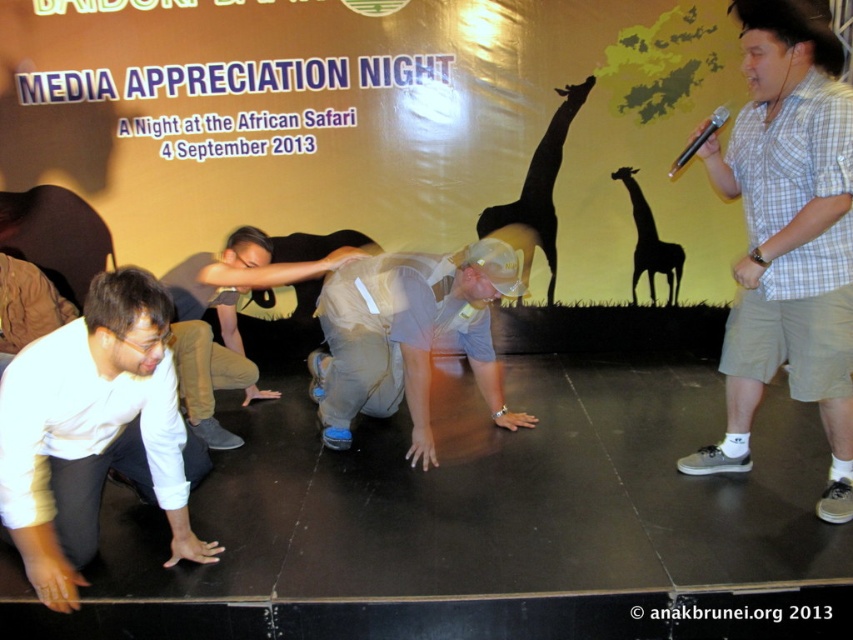
Is black matte giraffe at upper center wider than white plastic bag at center?

No, black matte giraffe at upper center is not wider than white plastic bag at center.

Between point (479, 236) and point (286, 236), which one is positioned behind?

The point (286, 236) is behind.

Is point (511, 212) farther from viewer compared to point (300, 257)?

No, (511, 212) is in front of (300, 257).

Where is `black matte giraffe at upper center`? This screenshot has height=640, width=853. black matte giraffe at upper center is located at coordinates (540, 182).

Can you confirm if white matte shirt at lower left is positioned to the left of white fabric bag at center?

Correct, you'll find white matte shirt at lower left to the left of white fabric bag at center.

Who is more forward, (102, 419) or (177, 289)?

Point (102, 419)

You are a GUI agent. You are given a task and a screenshot of the screen. Output one action in this format:
    pyautogui.click(x=<x>, y=<y>)
    Task: Click on the white matte shirt at lower left
    
    Given the screenshot: What is the action you would take?
    pyautogui.click(x=96, y=433)

Which is more to the right, white checkered shirt at upper right or white plastic bag at center?

Positioned to the right is white checkered shirt at upper right.

Between white checkered shirt at upper right and white plastic bag at center, which one has more height?

white checkered shirt at upper right

Who is more distant from viewer, [805,42] or [309,253]?

Point [309,253]

Identify the location of white checkered shirt at upper right. (788, 236).